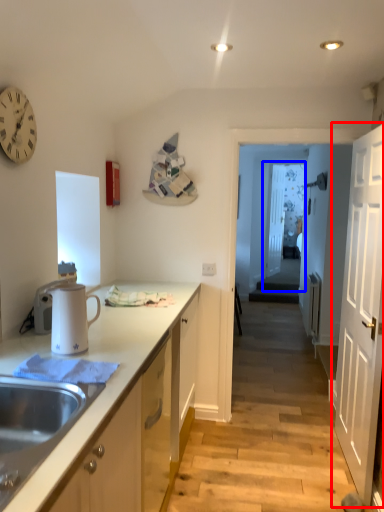
Question: Which point is closer to the camera, door (highlighted by a red box) or glass door (highlighted by a blue box)?

Choices:
 (A) door
 (B) glass door

Answer: (A)